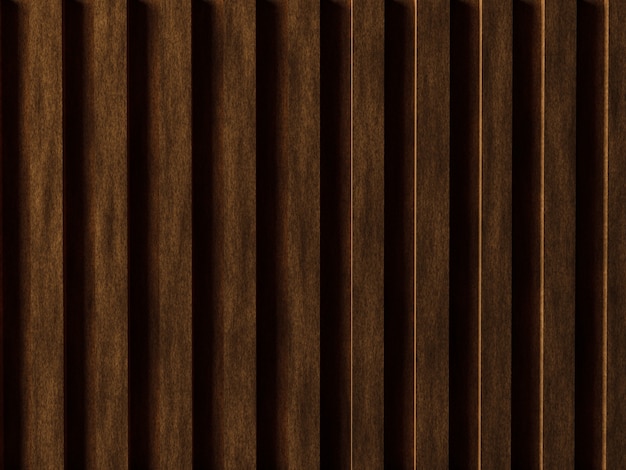
Where is `vertical wooden strips`? vertical wooden strips is located at coordinates (41, 266), (101, 264), (166, 267), (235, 272), (295, 267), (361, 273), (429, 267), (490, 270), (552, 277), (613, 282).